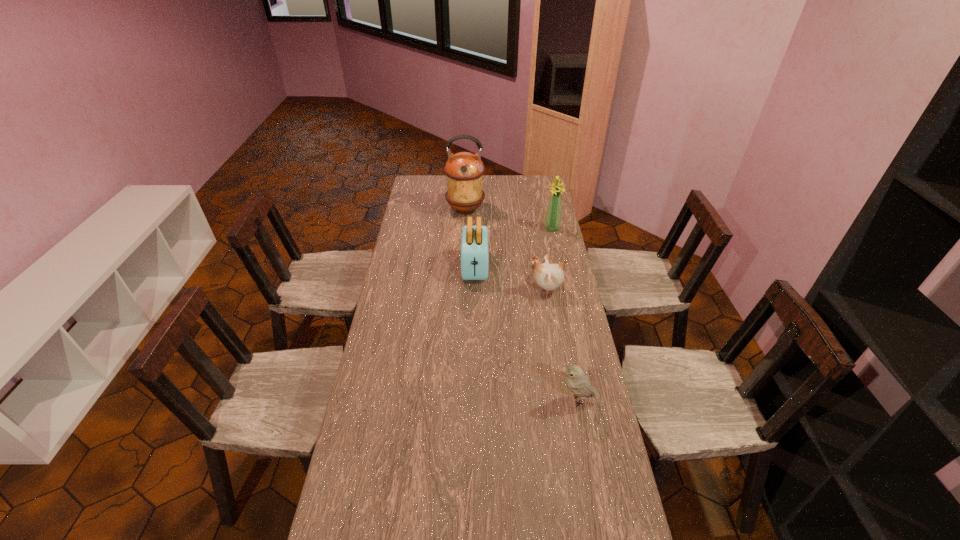
I want to click on empty space between the toaster and the nearer bird, so click(525, 334).

Where is `unoccupied position between the nearest object and the third shortest object`? unoccupied position between the nearest object and the third shortest object is located at coordinates (525, 334).

Identify the location of empty space between the bouquet and the nearest object. (564, 314).

This screenshot has width=960, height=540. Find the location of `free point between the bouquet and the third shortest object`. free point between the bouquet and the third shortest object is located at coordinates 514,248.

Find the location of a particular element. The image size is (960, 540). free space between the bouquet and the toaster is located at coordinates (514, 248).

Locate which object is the second closest to the farther bird. Please provide its 2D coordinates. Your answer should be formatted as a tuple, i.e. [(x, y)], where the tuple contains the x and y coordinates of a point satisfying the conditions above.

[(552, 223)]

At what (x,y) coordinates should I click in order to perform the action: click on object that is the second closest one to the farther bird. Please return your answer as a coordinate pair (x, y). Looking at the image, I should click on (552, 223).

Where is `vacant space that satisfies the following two spatial constraints: 1. on the front-facing side of the bouquet; 2. at the face of the nearer bird`? The height and width of the screenshot is (540, 960). vacant space that satisfies the following two spatial constraints: 1. on the front-facing side of the bouquet; 2. at the face of the nearer bird is located at coordinates (588, 400).